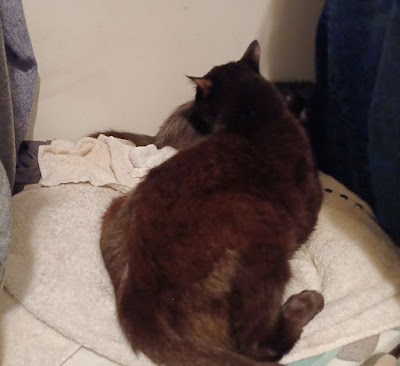
The image size is (400, 366). Find the location of `wall`. wall is located at coordinates (131, 49).